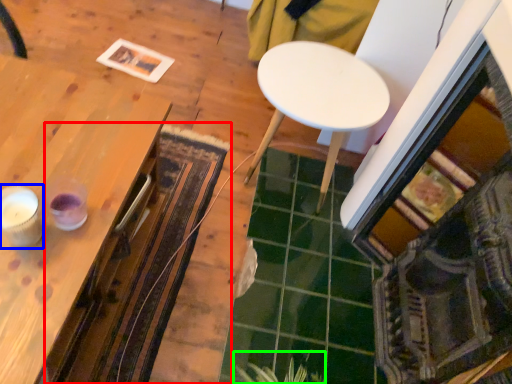
Question: Which object is the farthest from mat (highlighted by a red box)? Choose among these: candle holder (highlighted by a blue box) or plant (highlighted by a green box).

Choices:
 (A) candle holder
 (B) plant

Answer: (A)